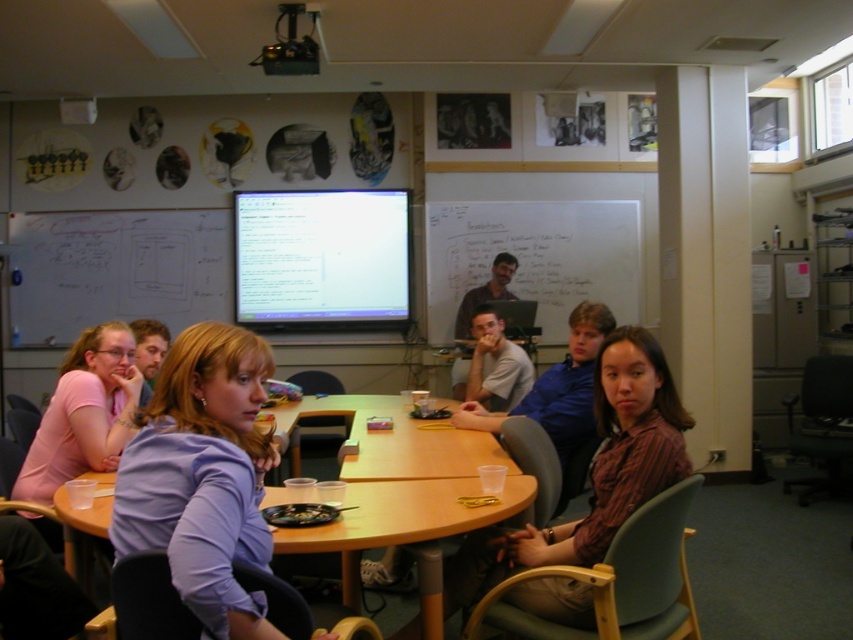
The image size is (853, 640). I want to click on striped cotton shirt at center, so click(x=595, y=472).

Which is more to the right, striped cotton shirt at center or wooden table at center?

striped cotton shirt at center is more to the right.

Who is more forward, (606,528) or (479,516)?

Point (606,528)

Identify the location of striped cotton shirt at center. (595, 472).

Does purple shirt at center appear over whiteboard at center?

Actually, purple shirt at center is below whiteboard at center.

Between purple shirt at center and whiteboard at center, which one has more height?

whiteboard at center is taller.

Does point (193, 488) lie behind point (451, 337)?

That is False.

At what (x,y) coordinates should I click in order to perform the action: click on purple shirt at center. Please return your answer as a coordinate pair (x, y). Looking at the image, I should click on (202, 476).

Identify the location of wooden table at center. (x=404, y=516).

Can you confirm if wooden table at center is thinner than matte brown shirt at center?

Incorrect, wooden table at center's width is not less than matte brown shirt at center's.

Is point (389, 502) in front of point (491, 282)?

Yes, point (389, 502) is closer to viewer.

The image size is (853, 640). I want to click on wooden table at center, so click(x=404, y=516).